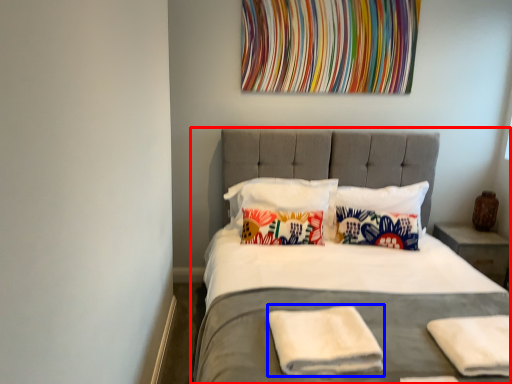
Question: Which object appears closest to the camera in this image, bed (highlighted by a red box) or material (highlighted by a blue box)?

Choices:
 (A) bed
 (B) material

Answer: (A)